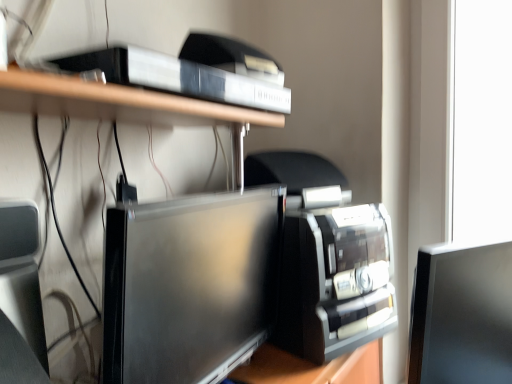
This screenshot has width=512, height=384. Describe the element at coordinates (462, 315) in the screenshot. I see `satin black monitor at right, the second computer monitor in the left-to-right sequence` at that location.

Where is `satin black monitor at right, which appears as the 1th computer monitor when viewed from the right`? Image resolution: width=512 pixels, height=384 pixels. satin black monitor at right, which appears as the 1th computer monitor when viewed from the right is located at coordinates (462, 315).

Which is nearer, (189,332) or (466,280)?

The point (189,332) is more forward.

Is there a large distance between satin black monitor at center, the 1th computer monitor in the left-to-right sequence, and satin black monitor at right, the second computer monitor in the left-to-right sequence?

satin black monitor at center, the 1th computer monitor in the left-to-right sequence, is actually quite close to satin black monitor at right, the second computer monitor in the left-to-right sequence.

How many degrees apart are the facing directions of satin black monitor at center, the 1th computer monitor in the left-to-right sequence, and satin black monitor at right, which appears as the 1th computer monitor when viewed from the right?

satin black monitor at center, the 1th computer monitor in the left-to-right sequence, and satin black monitor at right, which appears as the 1th computer monitor when viewed from the right, are facing 34.2 degrees away from each other.

Considering the sizes of satin black monitor at center, which is the 2th computer monitor in right-to-left order, and satin black monitor at right, the second computer monitor in the left-to-right sequence, in the image, is satin black monitor at center, which is the 2th computer monitor in right-to-left order, bigger or smaller than satin black monitor at right, the second computer monitor in the left-to-right sequence,?

satin black monitor at center, which is the 2th computer monitor in right-to-left order, is bigger than satin black monitor at right, the second computer monitor in the left-to-right sequence.

From the image's perspective, does satin black monitor at center, which is the 2th computer monitor in right-to-left order, appear higher than white plastic shelf at upper center?

Actually, satin black monitor at center, which is the 2th computer monitor in right-to-left order, appears below white plastic shelf at upper center in the image.

How much distance is there between satin black monitor at center, the 1th computer monitor in the left-to-right sequence, and white plastic shelf at upper center?

satin black monitor at center, the 1th computer monitor in the left-to-right sequence, and white plastic shelf at upper center are 9.36 inches apart.

Choose the correct answer: Is satin black monitor at center, the 1th computer monitor in the left-to-right sequence, inside white plastic shelf at upper center or outside it?

satin black monitor at center, the 1th computer monitor in the left-to-right sequence, lies outside white plastic shelf at upper center.

Visually, is white plastic shelf at upper center positioned to the left or to the right of satin black monitor at right, the second computer monitor in the left-to-right sequence?

In the image, white plastic shelf at upper center appears on the left side of satin black monitor at right, the second computer monitor in the left-to-right sequence.

Could you measure the distance between white plastic shelf at upper center and satin black monitor at right, the second computer monitor in the left-to-right sequence?

white plastic shelf at upper center is 19.62 inches away from satin black monitor at right, the second computer monitor in the left-to-right sequence.

From a real-world perspective, is white plastic shelf at upper center on satin black monitor at right, which appears as the 1th computer monitor when viewed from the right?

Correct, in the physical world, white plastic shelf at upper center is higher than satin black monitor at right, which appears as the 1th computer monitor when viewed from the right.

Considering the positions of point (194, 118) and point (482, 366), is point (194, 118) closer or farther from the camera than point (482, 366)?

Clearly, point (194, 118) is more distant from the camera than point (482, 366).

Which of these two, satin black monitor at right, the second computer monitor in the left-to-right sequence, or satin black monitor at center, which is the 2th computer monitor in right-to-left order, stands taller?

With more height is satin black monitor at right, the second computer monitor in the left-to-right sequence.

Between satin black monitor at right, the second computer monitor in the left-to-right sequence, and satin black monitor at center, the 1th computer monitor in the left-to-right sequence, which one has larger size?

satin black monitor at center, the 1th computer monitor in the left-to-right sequence.

In the image, there is a satin black monitor at center, the 1th computer monitor in the left-to-right sequence. Where is `computer monitor below it (from a real-world perspective)`? computer monitor below it (from a real-world perspective) is located at coordinates coord(462,315).

Which is in front, point (411, 357) or point (222, 269)?

Positioned in front is point (222, 269).

Is white plastic shelf at upper center at the left side of satin black monitor at center, the 1th computer monitor in the left-to-right sequence?

Yes, white plastic shelf at upper center is to the left of satin black monitor at center, the 1th computer monitor in the left-to-right sequence.

From the image's perspective, which is above, white plastic shelf at upper center or satin black monitor at center, which is the 2th computer monitor in right-to-left order?

white plastic shelf at upper center is shown above in the image.

Is the surface of white plastic shelf at upper center in direct contact with satin black monitor at center, the 1th computer monitor in the left-to-right sequence?

No, white plastic shelf at upper center is not in contact with satin black monitor at center, the 1th computer monitor in the left-to-right sequence.

The image size is (512, 384). Find the location of `shelf behind the satin black monitor at center, the 1th computer monitor in the left-to-right sequence`. shelf behind the satin black monitor at center, the 1th computer monitor in the left-to-right sequence is located at coordinates (117, 102).

Is satin black monitor at right, the second computer monitor in the left-to-right sequence, not close to white plastic shelf at upper center?

No, satin black monitor at right, the second computer monitor in the left-to-right sequence, is in close proximity to white plastic shelf at upper center.

At what (x,y) coordinates should I click in order to perform the action: click on computer monitor behind the white plastic shelf at upper center. Please return your answer as a coordinate pair (x, y). This screenshot has width=512, height=384. Looking at the image, I should click on (462, 315).

From the image's perspective, does satin black monitor at right, which appears as the 1th computer monitor when viewed from the right, appear higher than white plastic shelf at upper center?

No, from the image's perspective, satin black monitor at right, which appears as the 1th computer monitor when viewed from the right, is not above white plastic shelf at upper center.

Locate an element on the screen. The height and width of the screenshot is (384, 512). computer monitor that is on the left side of satin black monitor at right, the second computer monitor in the left-to-right sequence is located at coordinates (189, 285).

I want to click on the 1st computer monitor located beneath the white plastic shelf at upper center (from a real-world perspective), so click(x=189, y=285).

Looking at the image, which one is located closer to satin black monitor at center, the 1th computer monitor in the left-to-right sequence, satin black monitor at right, the second computer monitor in the left-to-right sequence, or white plastic shelf at upper center?

Based on the image, white plastic shelf at upper center appears to be nearer to satin black monitor at center, the 1th computer monitor in the left-to-right sequence.

When comparing their distances from satin black monitor at right, which appears as the 1th computer monitor when viewed from the right, does satin black monitor at center, which is the 2th computer monitor in right-to-left order, or white plastic shelf at upper center seem closer?

The object closer to satin black monitor at right, which appears as the 1th computer monitor when viewed from the right, is satin black monitor at center, which is the 2th computer monitor in right-to-left order.

Looking at the image, which one is located further to satin black monitor at center, which is the 2th computer monitor in right-to-left order, white plastic shelf at upper center or satin black monitor at right, the second computer monitor in the left-to-right sequence?

The object further to satin black monitor at center, which is the 2th computer monitor in right-to-left order, is satin black monitor at right, the second computer monitor in the left-to-right sequence.

Considering their positions, is satin black monitor at right, the second computer monitor in the left-to-right sequence, positioned further to white plastic shelf at upper center than satin black monitor at center, the 1th computer monitor in the left-to-right sequence?

satin black monitor at right, the second computer monitor in the left-to-right sequence, lies further to white plastic shelf at upper center than the other object.

Looking at the image, which one is located further to white plastic shelf at upper center, satin black monitor at center, which is the 2th computer monitor in right-to-left order, or satin black monitor at right, which appears as the 1th computer monitor when viewed from the right?

Among the two, satin black monitor at right, which appears as the 1th computer monitor when viewed from the right, is located further to white plastic shelf at upper center.

Estimate the real-world distances between objects in this image. Which object is further from satin black monitor at right, which appears as the 1th computer monitor when viewed from the right, white plastic shelf at upper center or satin black monitor at center, which is the 2th computer monitor in right-to-left order?

white plastic shelf at upper center lies further to satin black monitor at right, which appears as the 1th computer monitor when viewed from the right, than the other object.

At what (x,y) coordinates should I click in order to perform the action: click on computer monitor between white plastic shelf at upper center and satin black monitor at right, the second computer monitor in the left-to-right sequence. Please return your answer as a coordinate pair (x, y). Image resolution: width=512 pixels, height=384 pixels. Looking at the image, I should click on (189, 285).